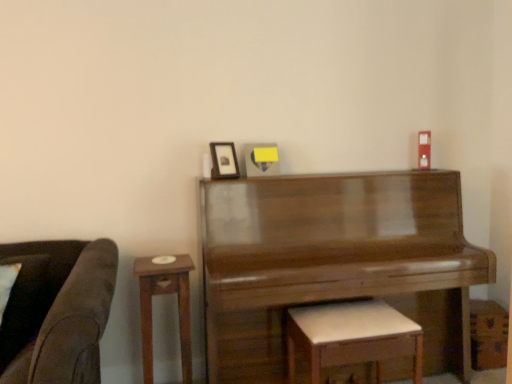
Locate an element on the screen. The image size is (512, 384). matte black picture frame at upper center is located at coordinates (224, 161).

This screenshot has height=384, width=512. What are the coordinates of `white leather stool at lower center` in the screenshot? It's located at (352, 336).

Describe the element at coordinates (334, 262) in the screenshot. The image size is (512, 384). I see `shiny brown piano at center` at that location.

You are a GUI agent. You are given a task and a screenshot of the screen. Output one action in this format:
    pyautogui.click(x=<x>, y=<y>)
    Task: Click on the shiny brown piano at center
    The image size is (512, 384).
    Given the screenshot: What is the action you would take?
    pyautogui.click(x=334, y=262)

Where is `matte black picture frame at upper center`? The image size is (512, 384). matte black picture frame at upper center is located at coordinates (224, 161).

Is point (454, 357) positioned before point (234, 148)?

That is False.

Could you tell me if shiny brown piano at center is turned towards matte black picture frame at upper center?

No, shiny brown piano at center is not turned towards matte black picture frame at upper center.

From the image's perspective, relative to matte black picture frame at upper center, is shiny brown piano at center above or below?

shiny brown piano at center is situated lower than matte black picture frame at upper center in the image.

Based on the photo, does shiny brown piano at center have a greater width compared to matte black picture frame at upper center?

Indeed, shiny brown piano at center has a greater width compared to matte black picture frame at upper center.

Would you consider shiny brown piano at center to be distant from wooden side table at left?

Actually, shiny brown piano at center and wooden side table at left are a little close together.

From a real-world perspective, which object stands above the other?

shiny brown piano at center is physically above.

Where is `piano in front of the wooden side table at left`? Image resolution: width=512 pixels, height=384 pixels. piano in front of the wooden side table at left is located at coordinates (334, 262).

From the image's perspective, is shiny brown piano at center located above or below wooden side table at left?

From the image's perspective, shiny brown piano at center appears above wooden side table at left.

Is matte black picture frame at upper center closer to camera compared to white leather stool at lower center?

No.

Would you say matte black picture frame at upper center contains white leather stool at lower center?

No, white leather stool at lower center is not inside matte black picture frame at upper center.

Would you say matte black picture frame at upper center is a long distance from white leather stool at lower center?

They are positioned close to each other.

From the picture: In the image, is wooden side table at left positioned in front of or behind white leather stool at lower center?

wooden side table at left is positioned farther from the viewer than white leather stool at lower center.

Which of these two, wooden side table at left or white leather stool at lower center, is bigger?

white leather stool at lower center.

From the image's perspective, between wooden side table at left and white leather stool at lower center, which one is located above?

wooden side table at left, from the image's perspective.

From their relative heights in the image, would you say wooden side table at left is taller or shorter than white leather stool at lower center?

Clearly, wooden side table at left is taller compared to white leather stool at lower center.

Locate an element on the screen. This screenshot has height=384, width=512. piano below the matte black picture frame at upper center (from the image's perspective) is located at coordinates (334, 262).

Is matte black picture frame at upper center inside or outside of shiny brown piano at center?

matte black picture frame at upper center lies outside shiny brown piano at center.

Which of these two, matte black picture frame at upper center or shiny brown piano at center, is wider?

shiny brown piano at center.

Measure the distance from matte black picture frame at upper center to shiny brown piano at center.

matte black picture frame at upper center is 69.60 centimeters from shiny brown piano at center.

From a real-world perspective, relative to white leather stool at lower center, is shiny brown piano at center vertically above or below?

shiny brown piano at center is situated higher than white leather stool at lower center in the real world.

Is shiny brown piano at center at the right side of white leather stool at lower center?

Incorrect, shiny brown piano at center is not on the right side of white leather stool at lower center.

Is shiny brown piano at center not near white leather stool at lower center?

No, there isn't a large distance between shiny brown piano at center and white leather stool at lower center.

Considering the relative sizes of shiny brown piano at center and white leather stool at lower center in the image provided, is shiny brown piano at center taller than white leather stool at lower center?

Yes.

From a real-world perspective, between white leather stool at lower center and wooden side table at left, who is vertically lower?

From a 3D spatial view, white leather stool at lower center is below.

The height and width of the screenshot is (384, 512). In order to click on stool in front of the wooden side table at left in this screenshot , I will do `click(352, 336)`.

Between white leather stool at lower center and wooden side table at left, which one has less height?

With less height is white leather stool at lower center.

Is white leather stool at lower center thinner than wooden side table at left?

In fact, white leather stool at lower center might be wider than wooden side table at left.

Identify the location of piano below the matte black picture frame at upper center (from a real-world perspective). The image size is (512, 384). (334, 262).

Where is `piano lying above the wooden side table at left (from the image's perspective)`? This screenshot has width=512, height=384. piano lying above the wooden side table at left (from the image's perspective) is located at coordinates (334, 262).

Based on their spatial positions, is matte black picture frame at upper center or white leather stool at lower center closer to wooden side table at left?

Among the two, matte black picture frame at upper center is located nearer to wooden side table at left.

Considering their positions, is white leather stool at lower center positioned closer to matte black picture frame at upper center than wooden side table at left?

wooden side table at left lies closer to matte black picture frame at upper center than the other object.

Based on their spatial positions, is wooden side table at left or matte black picture frame at upper center closer to shiny brown piano at center?

wooden side table at left lies closer to shiny brown piano at center than the other object.

From the image, which object appears to be farther from white leather stool at lower center, wooden side table at left or shiny brown piano at center?

wooden side table at left is positioned further to the anchor white leather stool at lower center.

Looking at the image, which one is located further to shiny brown piano at center, white leather stool at lower center or matte black picture frame at upper center?

matte black picture frame at upper center.

Estimate the real-world distances between objects in this image. Which object is closer to matte black picture frame at upper center, white leather stool at lower center or shiny brown piano at center?

shiny brown piano at center.

When comparing their distances from matte black picture frame at upper center, does wooden side table at left or shiny brown piano at center seem closer?

wooden side table at left.

When comparing their distances from shiny brown piano at center, does white leather stool at lower center or wooden side table at left seem further?

wooden side table at left is further to shiny brown piano at center.

Where is `piano between matte black picture frame at upper center and white leather stool at lower center in the up-down direction`? Image resolution: width=512 pixels, height=384 pixels. piano between matte black picture frame at upper center and white leather stool at lower center in the up-down direction is located at coordinates (334, 262).

Where is `table between matte black picture frame at upper center and white leather stool at lower center in the vertical direction`? This screenshot has height=384, width=512. table between matte black picture frame at upper center and white leather stool at lower center in the vertical direction is located at coordinates (165, 294).

The width and height of the screenshot is (512, 384). In order to click on piano between wooden side table at left and white leather stool at lower center in this screenshot , I will do `click(334, 262)`.

Find the location of a particular element. This screenshot has width=512, height=384. picture frame between wooden side table at left and shiny brown piano at center is located at coordinates (224, 161).